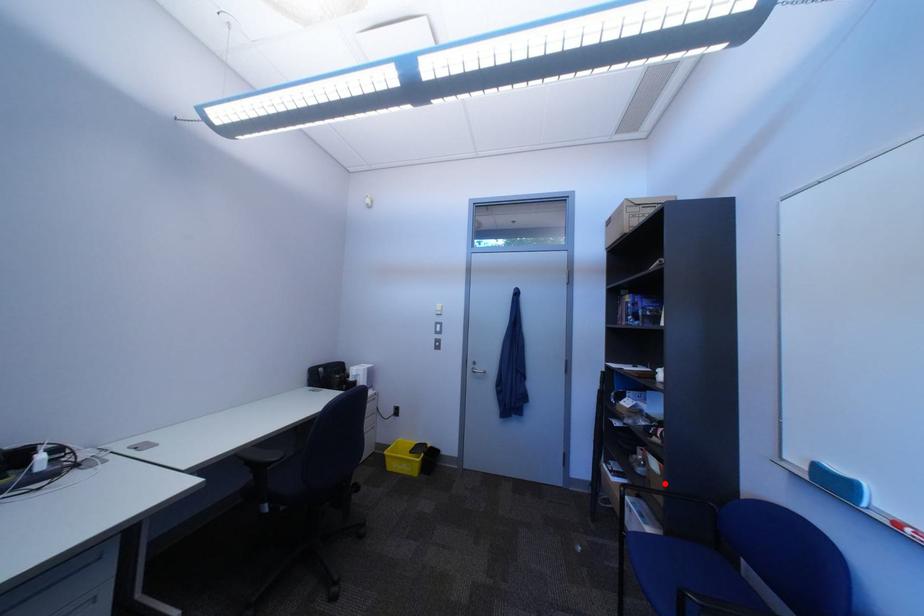
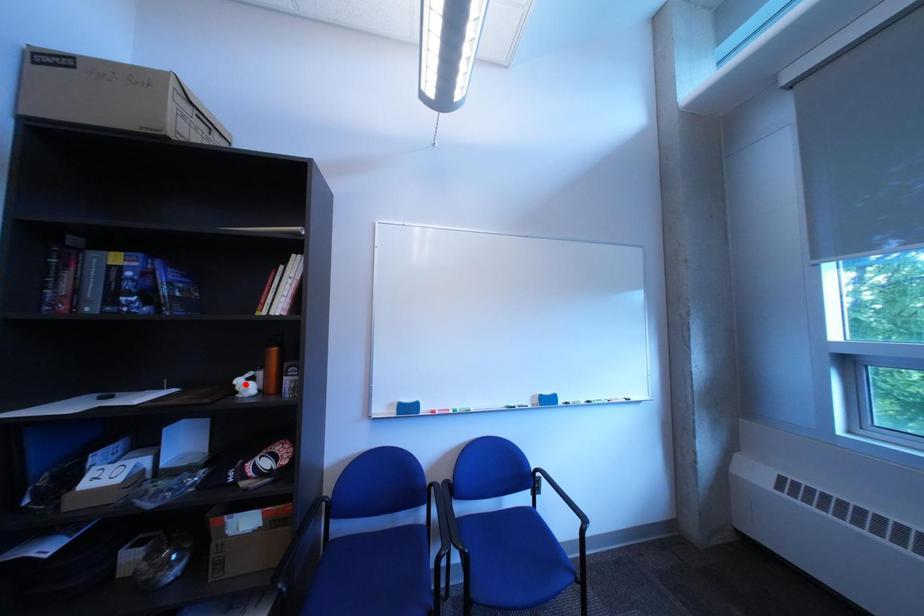
I am providing you with two images of the same scene from different viewpoints. A red point is marked on the first image and another point is marked on the second image. Are the points marked in image1 and image2 representing the same 3D position?

No